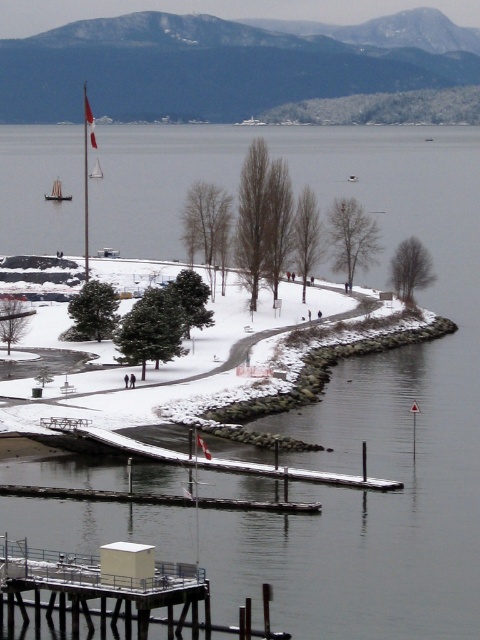
Which is more to the right, wooden sailboat at upper left or white sailboat at upper left?

From the viewer's perspective, white sailboat at upper left appears more on the right side.

Is point (64, 195) positioned after point (93, 172)?

No, (64, 195) is in front of (93, 172).

At what (x,y) coordinates should I click in order to perform the action: click on wooden sailboat at upper left. Please return your answer as a coordinate pair (x, y). This screenshot has width=480, height=640. Looking at the image, I should click on (57, 193).

Which is behind, point (57, 419) or point (71, 198)?

Point (71, 198)

Which is more to the left, wooden dock at center or wooden sailboat at upper left?

Positioned to the left is wooden sailboat at upper left.

This screenshot has height=640, width=480. In order to click on wooden dock at center in this screenshot , I will do `click(298, 474)`.

I want to click on wooden dock at center, so click(298, 474).

Who is more distant from viewer, (180, 577) or (58, 198)?

The point (58, 198) is behind.

Does metallic gray dock at lower left have a smaller size compared to wooden sailboat at upper left?

Actually, metallic gray dock at lower left might be larger than wooden sailboat at upper left.

The height and width of the screenshot is (640, 480). In order to click on metallic gray dock at lower left in this screenshot , I will do `click(109, 598)`.

Find the location of `metallic gray dock at lower left`. metallic gray dock at lower left is located at coordinates point(109,598).